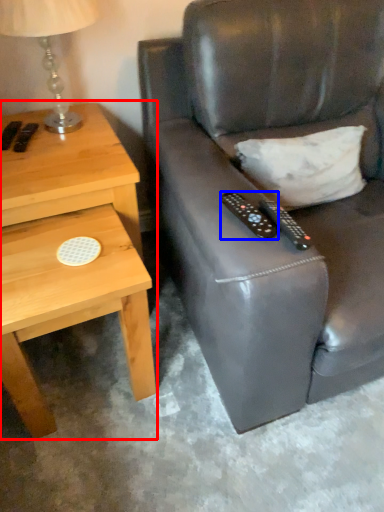
Question: Among these objects, which one is nearest to the camera, nightstand (highlighted by a red box) or remote control (highlighted by a blue box)?

Choices:
 (A) nightstand
 (B) remote control

Answer: (B)